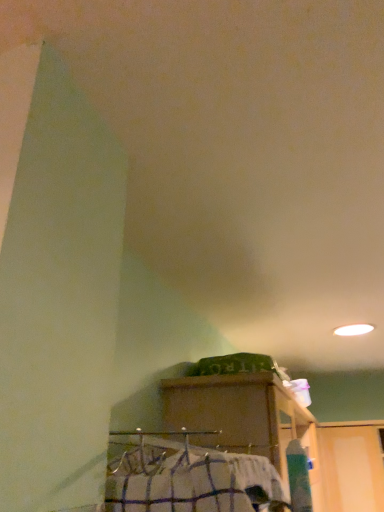
Question: Is white checkered shirt at lower center smaller than wooden cabinet at lower center?

Choices:
 (A) yes
 (B) no

Answer: (A)

Question: From a real-world perspective, is white checkered shirt at lower center physically below wooden cabinet at lower center?

Choices:
 (A) no
 (B) yes

Answer: (B)

Question: Is white checkered shirt at lower center thinner than wooden cabinet at lower center?

Choices:
 (A) yes
 (B) no

Answer: (A)

Question: Is wooden cabinet at lower center located within white checkered shirt at lower center?

Choices:
 (A) no
 (B) yes

Answer: (A)

Question: From the image's perspective, is white checkered shirt at lower center below wooden cabinet at lower center?

Choices:
 (A) no
 (B) yes

Answer: (A)

Question: Is white checkered shirt at lower center at the left side of wooden cabinet at lower center?

Choices:
 (A) no
 (B) yes

Answer: (B)

Question: Is wooden cabinet at lower center smaller than white checkered shirt at lower center?

Choices:
 (A) no
 (B) yes

Answer: (A)

Question: From a real-world perspective, is wooden cabinet at lower center below white checkered shirt at lower center?

Choices:
 (A) no
 (B) yes

Answer: (A)

Question: Considering the relative sizes of wooden cabinet at lower center and white checkered shirt at lower center in the image provided, is wooden cabinet at lower center taller than white checkered shirt at lower center?

Choices:
 (A) no
 (B) yes

Answer: (B)

Question: Is white checkered shirt at lower center surrounded by wooden cabinet at lower center?

Choices:
 (A) yes
 (B) no

Answer: (B)

Question: Is the depth of wooden cabinet at lower center greater than that of white checkered shirt at lower center?

Choices:
 (A) yes
 (B) no

Answer: (A)

Question: From a real-world perspective, is wooden cabinet at lower center over white checkered shirt at lower center?

Choices:
 (A) yes
 (B) no

Answer: (A)

Question: From a real-world perspective, is wooden cabinet at lower center above or below white checkered shirt at lower center?

Choices:
 (A) above
 (B) below

Answer: (A)